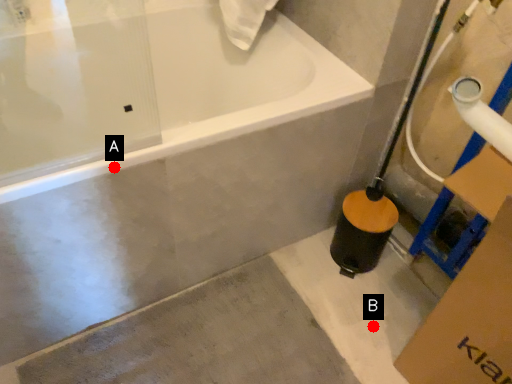
Question: Two points are circled on the image, labeled by A and B beside each circle. Which of the following is the closest to the observer?

Choices:
 (A) A is closer
 (B) B is closer

Answer: (A)